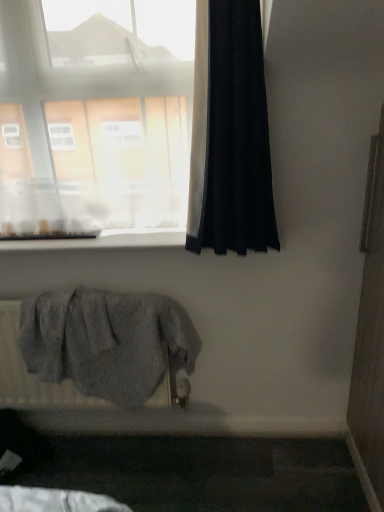
Question: Is transparent glass window at upper left further to camera compared to gray fabric radiator at lower left?

Choices:
 (A) yes
 (B) no

Answer: (B)

Question: Is transparent glass window at upper left beside gray fabric radiator at lower left?

Choices:
 (A) no
 (B) yes

Answer: (A)

Question: Is transparent glass window at upper left thinner than gray fabric radiator at lower left?

Choices:
 (A) yes
 (B) no

Answer: (A)

Question: Considering the relative sizes of transparent glass window at upper left and gray fabric radiator at lower left in the image provided, is transparent glass window at upper left taller than gray fabric radiator at lower left?

Choices:
 (A) yes
 (B) no

Answer: (A)

Question: Considering the relative positions of transparent glass window at upper left and gray fabric radiator at lower left in the image provided, is transparent glass window at upper left to the right of gray fabric radiator at lower left from the viewer's perspective?

Choices:
 (A) no
 (B) yes

Answer: (A)

Question: Is gray fabric radiator at lower left completely or partially inside transparent glass window at upper left?

Choices:
 (A) no
 (B) yes

Answer: (A)

Question: Is white smooth window sill at upper center not near black fabric curtain at right?

Choices:
 (A) yes
 (B) no

Answer: (B)

Question: Is white smooth window sill at upper center positioned with its back to black fabric curtain at right?

Choices:
 (A) yes
 (B) no

Answer: (B)

Question: Does white smooth window sill at upper center appear on the left side of black fabric curtain at right?

Choices:
 (A) yes
 (B) no

Answer: (A)

Question: Is white smooth window sill at upper center closer to camera compared to black fabric curtain at right?

Choices:
 (A) yes
 (B) no

Answer: (B)

Question: From a real-world perspective, is white smooth window sill at upper center on black fabric curtain at right?

Choices:
 (A) no
 (B) yes

Answer: (A)

Question: Is white smooth window sill at upper center surrounding black fabric curtain at right?

Choices:
 (A) no
 (B) yes

Answer: (A)

Question: From the image's perspective, does black fabric curtain at right appear lower than transparent glass window at upper left?

Choices:
 (A) no
 (B) yes

Answer: (B)